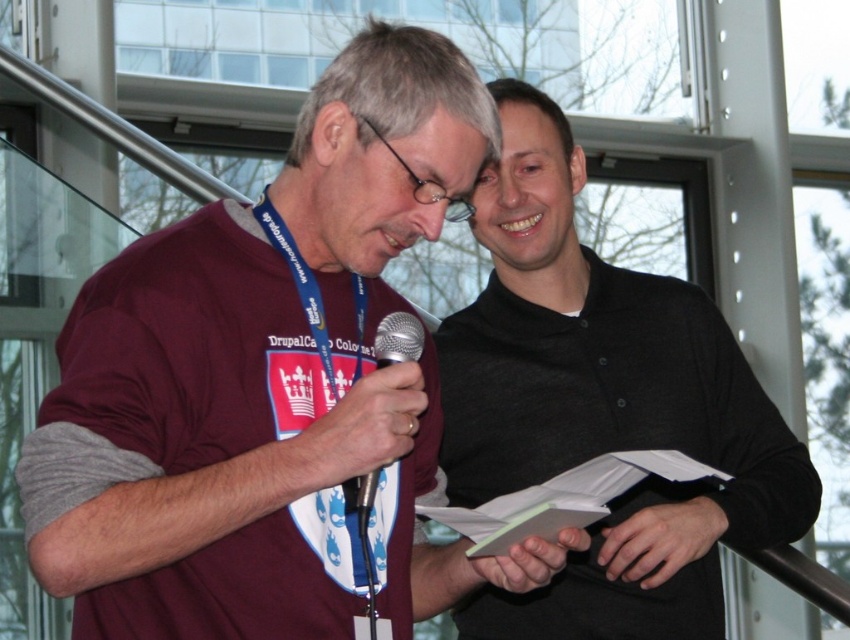
Question: Which of the following is the closest to the observer?

Choices:
 (A) blue fabric lanyard at center
 (B) black matte hand at lower center
 (C) maroon jersey at center
 (D) metallic silver microphone at center

Answer: (C)

Question: Is black matte hand at lower center to the left of smooth white card at center from the viewer's perspective?

Choices:
 (A) yes
 (B) no

Answer: (B)

Question: Where is black matte shirt at center located in relation to matte black microphone at center in the image?

Choices:
 (A) right
 (B) left

Answer: (A)

Question: Can you confirm if maroon jersey at center is positioned below black matte shirt at center?

Choices:
 (A) no
 (B) yes

Answer: (B)

Question: Which point appears farthest from the camera in this image?

Choices:
 (A) (735, 349)
 (B) (316, 470)
 (C) (389, 342)
 (D) (688, 509)

Answer: (A)

Question: Among these points, which one is nearest to the camera?

Choices:
 (A) (349, 492)
 (B) (457, 572)
 (C) (272, 548)

Answer: (C)